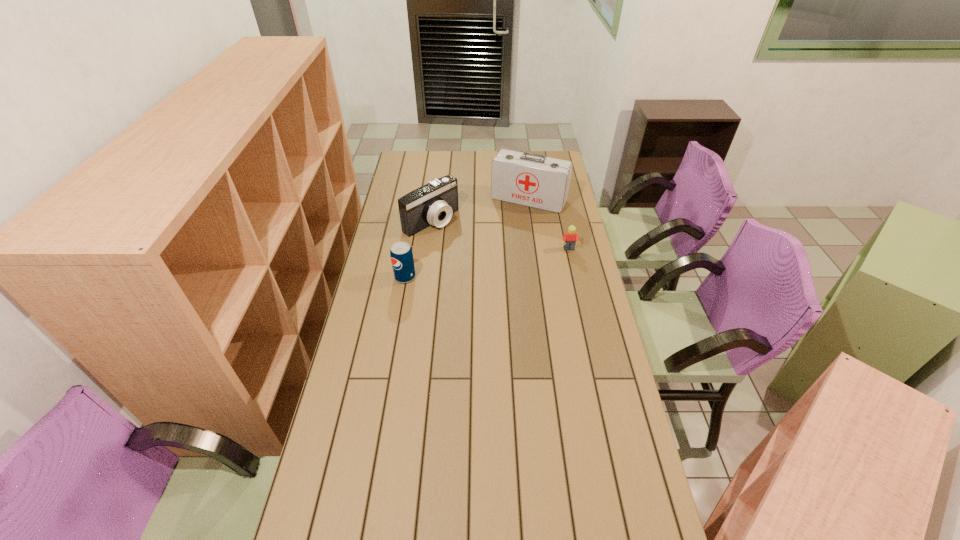
The image size is (960, 540). Identify the location of free spot on the desktop that is between the nearest object and the third farthest object and is positioned on the lens of the third shortest object. (492, 262).

Locate an element on the screen. The height and width of the screenshot is (540, 960). free space on the desktop that is between the nearest object and the Lego and is positioned on the front-facing side of the tallest object is located at coordinates (496, 261).